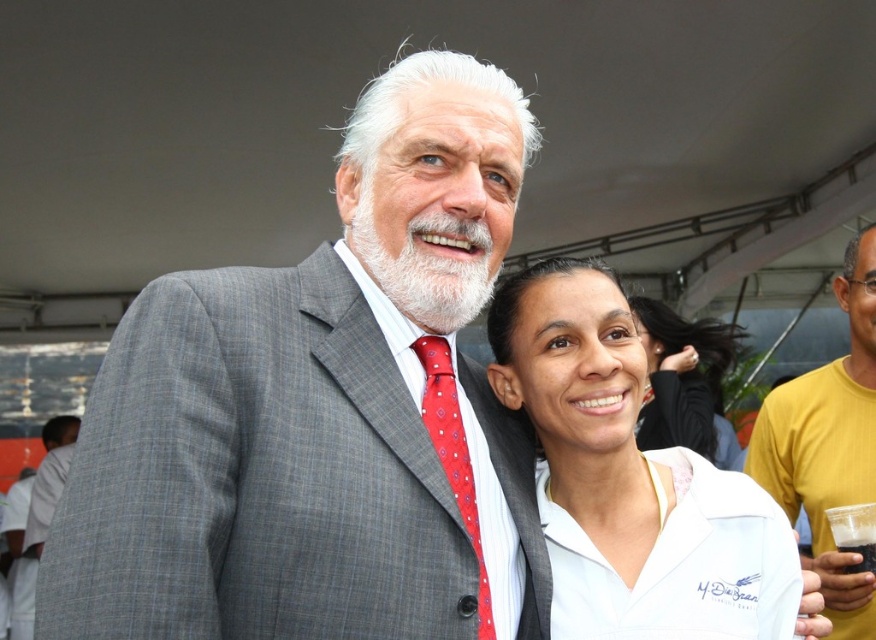
Does yellow cotton t-shirt at right lie in front of gray wool suit at upper left?

Yes, it is in front of gray wool suit at upper left.

Which of these two, yellow cotton t-shirt at right or gray wool suit at upper left, stands taller?

gray wool suit at upper left

I want to click on yellow cotton t-shirt at right, so click(x=829, y=445).

This screenshot has height=640, width=876. I want to click on yellow cotton t-shirt at right, so (829, 445).

Does point (563, 419) come closer to viewer compared to point (435, 440)?

No.

Between white cotton shirt at center and red silk tie at center, which one has less height?

Standing shorter between the two is red silk tie at center.

You are a GUI agent. You are given a task and a screenshot of the screen. Output one action in this format:
    pyautogui.click(x=<x>, y=<y>)
    Task: Click on the white cotton shirt at center
    The image size is (876, 640).
    Given the screenshot: What is the action you would take?
    pyautogui.click(x=622, y=472)

From the picture: Which is more to the right, white smooth hair at upper center or gray wool suit at upper left?

white smooth hair at upper center

Measure the distance from white smooth hair at upper center to gray wool suit at upper left.

A distance of 15.39 feet exists between white smooth hair at upper center and gray wool suit at upper left.

Is point (646, 300) in front of point (53, 481)?

That is True.

In order to click on white smooth hair at upper center in this screenshot , I will do `click(682, 376)`.